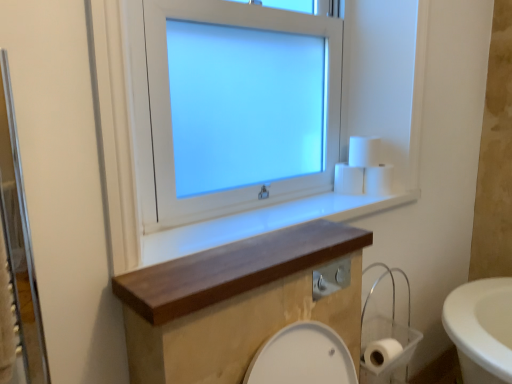
What do you see at coordinates (348, 179) in the screenshot?
I see `white matte toilet paper at center, acting as the 2th toilet paper starting from the top` at bounding box center [348, 179].

Describe the element at coordinates (364, 151) in the screenshot. I see `white matte toilet paper at upper right, positioned as the 4th toilet paper in bottom-to-top order` at that location.

Find the location of a particular element. This screenshot has width=512, height=384. white glossy window at upper center is located at coordinates (175, 111).

Is wooden at upper center at the right side of white glossy window at upper center?

Yes, wooden at upper center is to the right of white glossy window at upper center.

Which of these two, wooden at upper center or white glossy window at upper center, is bigger?

With larger size is white glossy window at upper center.

From the image's perspective, which is above, wooden at upper center or white glossy window at upper center?

white glossy window at upper center is shown above in the image.

Is wooden at upper center not close to white glossy window at upper center?

They are positioned close to each other.

Is white matte toilet paper at lower right, acting as the 4th toilet paper starting from the top, positioned with its back to wooden shelf at center?

white matte toilet paper at lower right, acting as the 4th toilet paper starting from the top, does not have its back to wooden shelf at center.

Consider the image. In the image, is white matte toilet paper at lower right, the first toilet paper positioned from the bottom, positioned in front of or behind wooden shelf at center?

white matte toilet paper at lower right, the first toilet paper positioned from the bottom, is behind wooden shelf at center.

Can you confirm if white matte toilet paper at lower right, acting as the 4th toilet paper starting from the top, is smaller than wooden shelf at center?

Indeed, white matte toilet paper at lower right, acting as the 4th toilet paper starting from the top, has a smaller size compared to wooden shelf at center.

Does white matte toilet paper at upper right, placed as the 2th toilet paper when sorted from bottom to top, touch white matte toilet paper at upper right, the 1th toilet paper viewed from the top?

Yes, white matte toilet paper at upper right, placed as the 2th toilet paper when sorted from bottom to top, is beside white matte toilet paper at upper right, the 1th toilet paper viewed from the top.

Considering the sizes of white matte toilet paper at upper right, placed as the 2th toilet paper when sorted from bottom to top, and white matte toilet paper at upper right, positioned as the 4th toilet paper in bottom-to-top order, in the image, is white matte toilet paper at upper right, placed as the 2th toilet paper when sorted from bottom to top, wider or thinner than white matte toilet paper at upper right, positioned as the 4th toilet paper in bottom-to-top order,?

Considering their sizes, white matte toilet paper at upper right, placed as the 2th toilet paper when sorted from bottom to top, looks broader than white matte toilet paper at upper right, positioned as the 4th toilet paper in bottom-to-top order.

The width and height of the screenshot is (512, 384). What are the coordinates of `toilet paper that is the 2nd one when counting downward from the white matte toilet paper at upper right, positioned as the 4th toilet paper in bottom-to-top order (from the image's perspective)` in the screenshot? It's located at (379, 179).

In the scene shown: From the image's perspective, is white matte toilet paper at upper right, positioned as the 4th toilet paper in bottom-to-top order, over wooden at upper center?

Yes, from the image's perspective, white matte toilet paper at upper right, positioned as the 4th toilet paper in bottom-to-top order, is above wooden at upper center.

What's the angular difference between white matte toilet paper at upper right, positioned as the 4th toilet paper in bottom-to-top order, and wooden at upper center's facing directions?

white matte toilet paper at upper right, positioned as the 4th toilet paper in bottom-to-top order, and wooden at upper center are facing 0.703 degrees away from each other.

Can you confirm if white matte toilet paper at upper right, the 1th toilet paper viewed from the top, is shorter than wooden at upper center?

No, white matte toilet paper at upper right, the 1th toilet paper viewed from the top, is not shorter than wooden at upper center.

Which object is more forward, white matte toilet paper at upper right, positioned as the 4th toilet paper in bottom-to-top order, or white matte toilet paper at center, the third toilet paper in the bottom-to-top sequence?

white matte toilet paper at upper right, positioned as the 4th toilet paper in bottom-to-top order, is closer to the camera.

Can you confirm if white matte toilet paper at upper right, positioned as the 4th toilet paper in bottom-to-top order, is wider than white matte toilet paper at center, the third toilet paper in the bottom-to-top sequence?

No.

From the image's perspective, relative to white matte toilet paper at center, acting as the 2th toilet paper starting from the top, is white matte toilet paper at upper right, the 1th toilet paper viewed from the top, above or below?

From the image's perspective, white matte toilet paper at upper right, the 1th toilet paper viewed from the top, appears above white matte toilet paper at center, acting as the 2th toilet paper starting from the top.

Could you tell me if white matte toilet paper at upper right, positioned as the 4th toilet paper in bottom-to-top order, is turned towards white matte toilet paper at upper right, placed as the 2th toilet paper when sorted from bottom to top?

No, white matte toilet paper at upper right, positioned as the 4th toilet paper in bottom-to-top order, is not facing towards white matte toilet paper at upper right, placed as the 2th toilet paper when sorted from bottom to top.

Considering the relative sizes of white matte toilet paper at upper right, positioned as the 4th toilet paper in bottom-to-top order, and white matte toilet paper at upper right, positioned as the third toilet paper in top-to-bottom order, in the image provided, is white matte toilet paper at upper right, positioned as the 4th toilet paper in bottom-to-top order, wider than white matte toilet paper at upper right, positioned as the third toilet paper in top-to-bottom order,?

No.

Who is bigger, white matte toilet paper at upper right, positioned as the 4th toilet paper in bottom-to-top order, or white matte toilet paper at upper right, positioned as the third toilet paper in top-to-bottom order?

With larger size is white matte toilet paper at upper right, positioned as the third toilet paper in top-to-bottom order.

What's the angular difference between white matte toilet paper at upper right, positioned as the 4th toilet paper in bottom-to-top order, and white matte toilet paper at upper right, positioned as the third toilet paper in top-to-bottom order,'s facing directions?

The angular difference between white matte toilet paper at upper right, positioned as the 4th toilet paper in bottom-to-top order, and white matte toilet paper at upper right, positioned as the third toilet paper in top-to-bottom order, is 0.0032 degrees.

Is white glossy window at upper center smaller than white matte toilet paper at center, acting as the 2th toilet paper starting from the top?

No.

Considering the positions of point (159, 41) and point (355, 189), is point (159, 41) closer or farther from the camera than point (355, 189)?

Point (159, 41) appears to be closer to the viewer than point (355, 189).

Considering the sizes of objects white glossy window at upper center and white matte toilet paper at center, the third toilet paper in the bottom-to-top sequence, in the image provided, who is thinner, white glossy window at upper center or white matte toilet paper at center, the third toilet paper in the bottom-to-top sequence,?

With smaller width is white glossy window at upper center.

This screenshot has width=512, height=384. I want to click on window sill in front of the white glossy window at upper center, so click(264, 222).

Where is `bathroom cabinet above the white matte toilet paper at lower right, acting as the 4th toilet paper starting from the top (from a real-world perspective)`? bathroom cabinet above the white matte toilet paper at lower right, acting as the 4th toilet paper starting from the top (from a real-world perspective) is located at coordinates (236, 302).

When comparing their distances from white matte toilet paper at upper right, positioned as the 4th toilet paper in bottom-to-top order, does wooden at upper center or white matte toilet paper at upper right, placed as the 2th toilet paper when sorted from bottom to top, seem closer?

white matte toilet paper at upper right, placed as the 2th toilet paper when sorted from bottom to top, lies closer to white matte toilet paper at upper right, positioned as the 4th toilet paper in bottom-to-top order, than the other object.

Which object lies nearer to the anchor point white matte toilet paper at upper right, placed as the 2th toilet paper when sorted from bottom to top, wooden shelf at center or white glossy window at upper center?

white glossy window at upper center.

Consider the image. Based on their spatial positions, is wooden shelf at center or wooden at upper center further from white matte toilet paper at upper right, positioned as the 4th toilet paper in bottom-to-top order?

Based on the image, wooden shelf at center appears to be further to white matte toilet paper at upper right, positioned as the 4th toilet paper in bottom-to-top order.

Looking at the image, which one is located closer to white glossy window at upper center, white matte toilet paper at upper right, positioned as the third toilet paper in top-to-bottom order, or white matte toilet paper at center, acting as the 2th toilet paper starting from the top?

Based on the image, white matte toilet paper at center, acting as the 2th toilet paper starting from the top, appears to be nearer to white glossy window at upper center.

From the image, which object appears to be farther from wooden at upper center, wooden shelf at center or white matte toilet paper at center, acting as the 2th toilet paper starting from the top?

The object further to wooden at upper center is white matte toilet paper at center, acting as the 2th toilet paper starting from the top.

Considering their positions, is white matte toilet paper at upper right, placed as the 2th toilet paper when sorted from bottom to top, positioned further to white matte toilet paper at center, the third toilet paper in the bottom-to-top sequence, than wooden shelf at center?

wooden shelf at center lies further to white matte toilet paper at center, the third toilet paper in the bottom-to-top sequence, than the other object.

Based on their spatial positions, is white matte toilet paper at upper right, positioned as the third toilet paper in top-to-bottom order, or white matte toilet paper at upper right, the 1th toilet paper viewed from the top, closer to wooden shelf at center?

The object closer to wooden shelf at center is white matte toilet paper at upper right, positioned as the third toilet paper in top-to-bottom order.

Considering their positions, is white matte toilet paper at upper right, positioned as the 4th toilet paper in bottom-to-top order, positioned further to white matte toilet paper at upper right, positioned as the third toilet paper in top-to-bottom order, than white matte toilet paper at lower right, the first toilet paper positioned from the bottom?

The object further to white matte toilet paper at upper right, positioned as the third toilet paper in top-to-bottom order, is white matte toilet paper at lower right, the first toilet paper positioned from the bottom.

The width and height of the screenshot is (512, 384). Find the location of `bathroom cabinet that lies between white glossy window at upper center and white matte toilet paper at lower right, the first toilet paper positioned from the bottom, from top to bottom`. bathroom cabinet that lies between white glossy window at upper center and white matte toilet paper at lower right, the first toilet paper positioned from the bottom, from top to bottom is located at coordinates (236, 302).

Locate an element on the screen. Image resolution: width=512 pixels, height=384 pixels. window between wooden at upper center and white matte toilet paper at center, the third toilet paper in the bottom-to-top sequence, along the z-axis is located at coordinates point(175,111).

Where is `window sill between white glossy window at upper center and white matte toilet paper at lower right, acting as the 4th toilet paper starting from the top, vertically`? The height and width of the screenshot is (384, 512). window sill between white glossy window at upper center and white matte toilet paper at lower right, acting as the 4th toilet paper starting from the top, vertically is located at coordinates (264, 222).

Image resolution: width=512 pixels, height=384 pixels. Identify the location of window located between wooden at upper center and white matte toilet paper at upper right, placed as the 2th toilet paper when sorted from bottom to top, in the depth direction. [x=175, y=111].